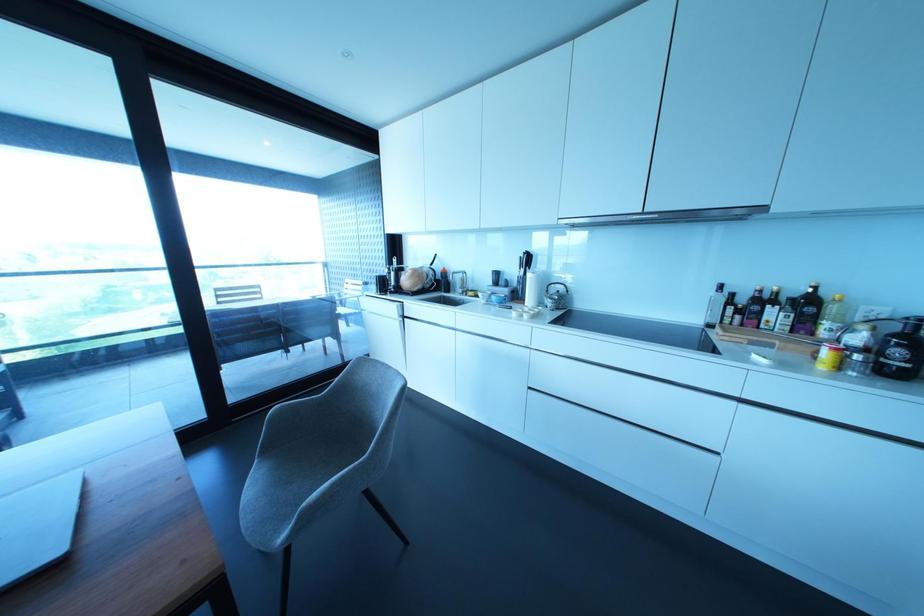
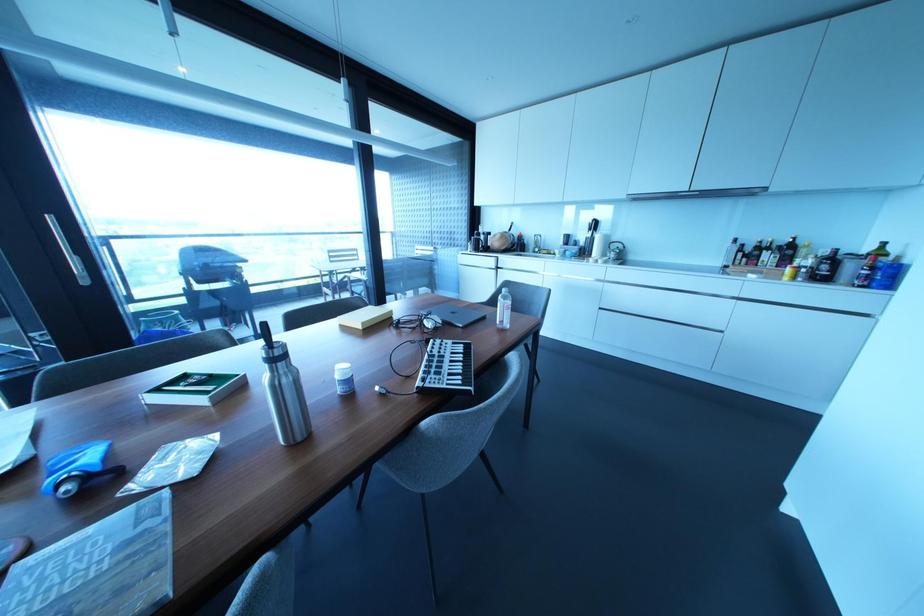
The point at (553,288) is marked in the first image. Where is the corresponding point in the second image?

(614, 245)